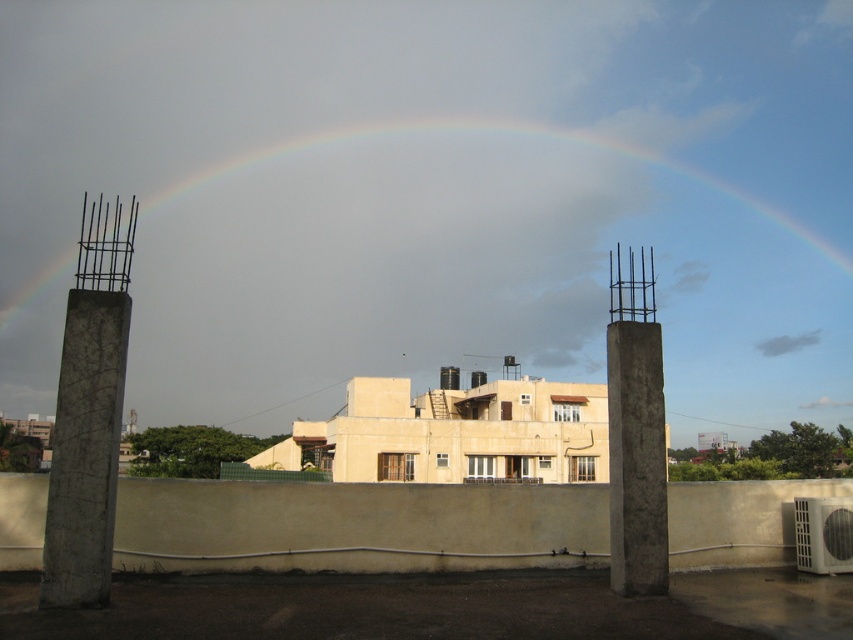
Question: Which point is closer to the camera taking this photo?

Choices:
 (A) (640, 369)
 (B) (113, 467)
 (C) (367, 186)

Answer: (B)

Question: Can you confirm if rainbow at upper center is wider than gray concrete pillar at right?

Choices:
 (A) yes
 (B) no

Answer: (A)

Question: Estimate the real-world distances between objects in this image. Which object is farther from the concrete rough at left?

Choices:
 (A) gray concrete pillar at right
 (B) rainbow at upper center

Answer: (B)

Question: Where is concrete rough at left located in relation to gray concrete pillar at right in the image?

Choices:
 (A) left
 (B) right

Answer: (A)

Question: Can you confirm if rainbow at upper center is positioned above concrete rough at left?

Choices:
 (A) no
 (B) yes

Answer: (B)

Question: Which object appears farthest from the camera in this image?

Choices:
 (A) concrete rough at left
 (B) gray concrete pillar at right
 (C) rainbow at upper center

Answer: (C)